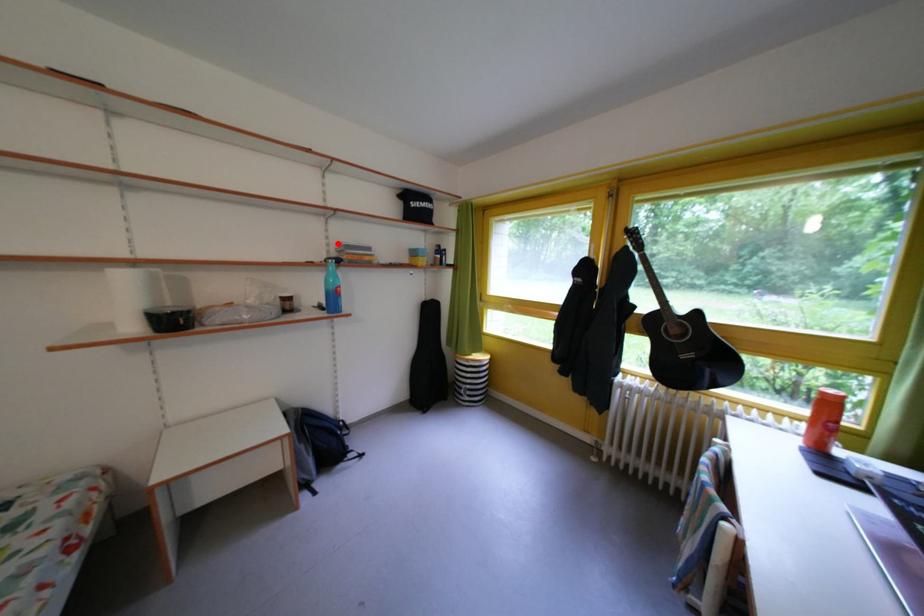
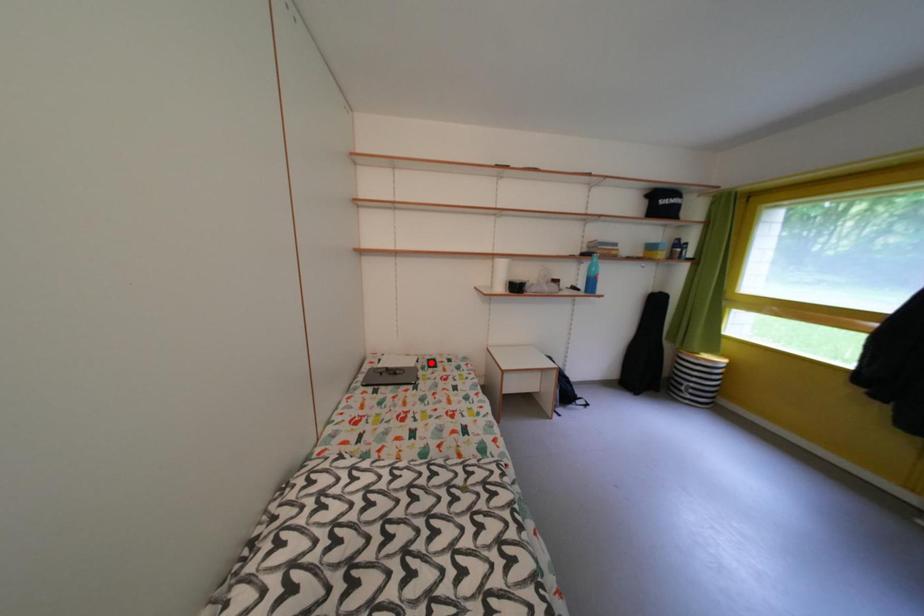
I am providing you with two images of the same scene from different viewpoints. A red point is marked on the first image and another point is marked on the second image. Is the marked point in image1 the same physical position as the marked point in image2?

No